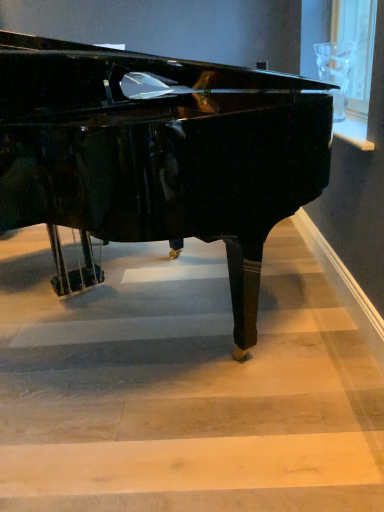
Question: Based on their sizes in the image, would you say wooden stairwell at center is bigger or smaller than glossy black piano at center?

Choices:
 (A) big
 (B) small

Answer: (B)

Question: From the image's perspective, is wooden stairwell at center located above or below glossy black piano at center?

Choices:
 (A) above
 (B) below

Answer: (B)

Question: Which of these objects is positioned closest to the wooden stairwell at center?

Choices:
 (A) transparent glass at upper right
 (B) glossy black piano at center

Answer: (B)

Question: Considering the real-world distances, which object is closest to the glossy black piano at center?

Choices:
 (A) transparent glass at upper right
 (B) wooden stairwell at center

Answer: (B)